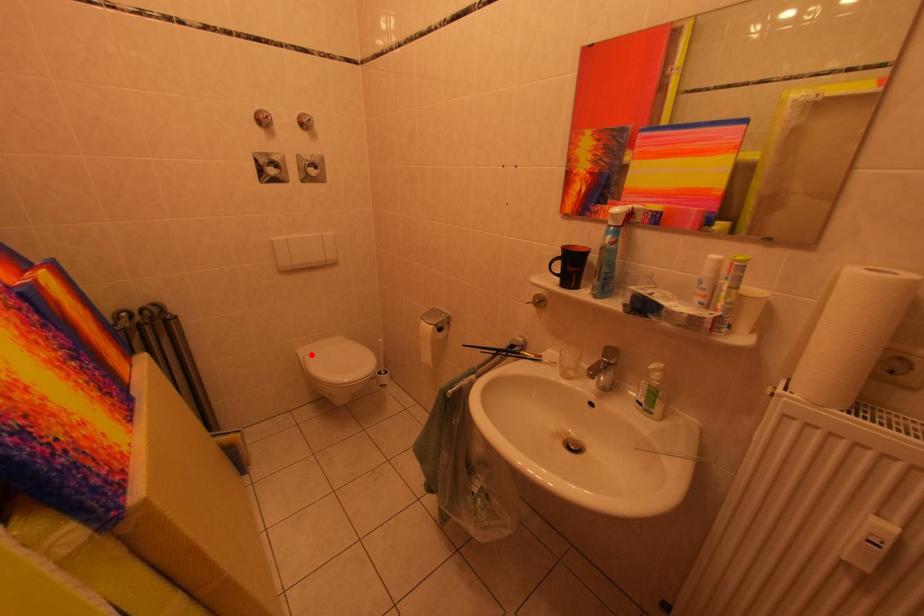
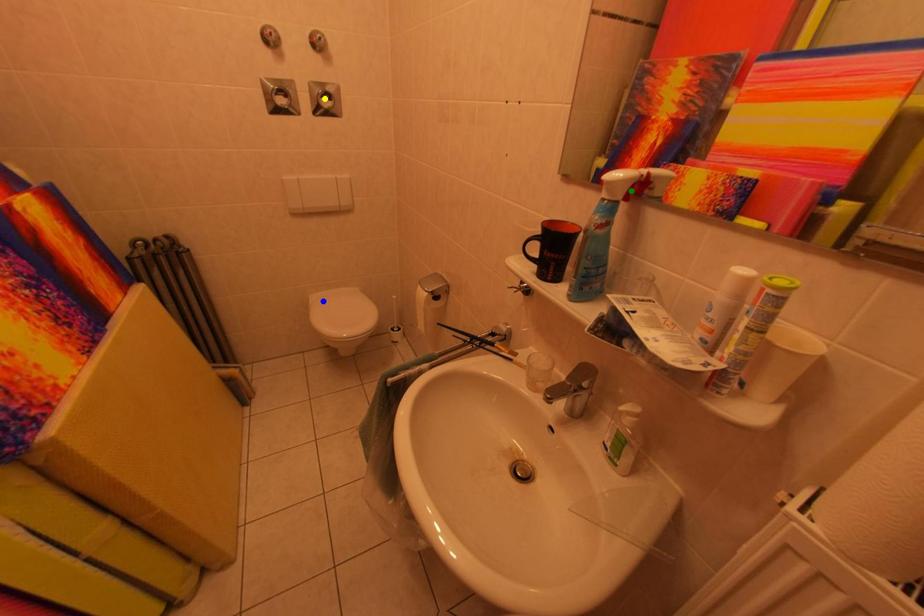
Question: I am providing you with two images of the same scene from different viewpoints. A red point is marked on the first image. You are given multiple points on the second image. Which mark in image 2 goes with the point in image 1?

Choices:
 (A) blue point
 (B) yellow point
 (C) green point

Answer: (A)